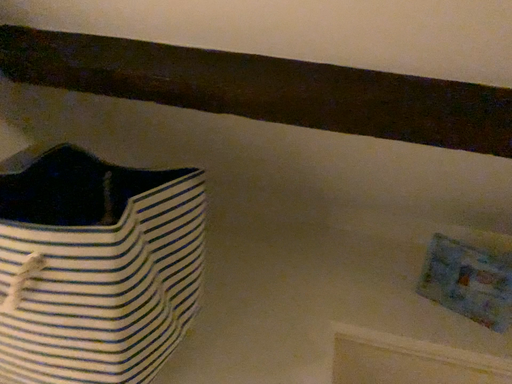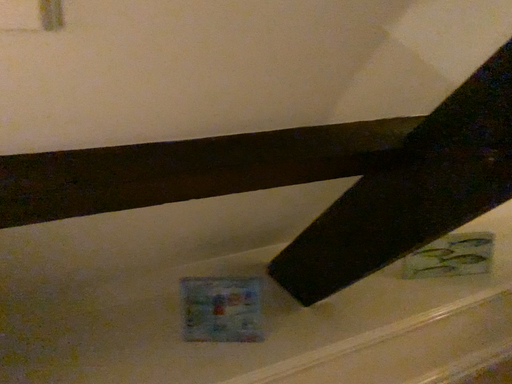
Question: How did the camera likely rotate when shooting the video?

Choices:
 (A) rotated left
 (B) rotated right

Answer: (B)